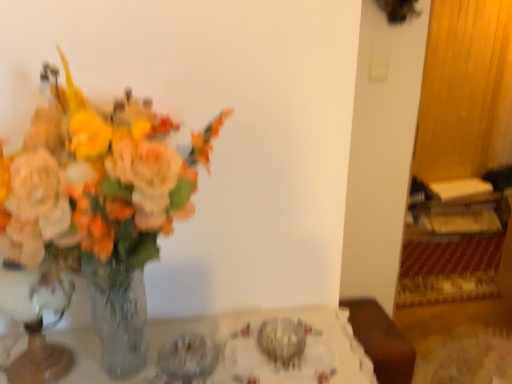
Question: Is translucent glass vase at left surrounding clear glass vase at left?

Choices:
 (A) no
 (B) yes

Answer: (B)

Question: Would you say translucent glass vase at left is a long distance from clear glass vase at left?

Choices:
 (A) no
 (B) yes

Answer: (A)

Question: Considering the relative sizes of translucent glass vase at left and clear glass vase at left in the image provided, is translucent glass vase at left thinner than clear glass vase at left?

Choices:
 (A) no
 (B) yes

Answer: (A)

Question: Can you confirm if translucent glass vase at left is positioned to the left of clear glass vase at left?

Choices:
 (A) no
 (B) yes

Answer: (A)

Question: Does translucent glass vase at left come in front of clear glass vase at left?

Choices:
 (A) no
 (B) yes

Answer: (B)

Question: Looking at their shapes, would you say clear glass vase at left is wider or thinner than clear glass vase at left?

Choices:
 (A) thin
 (B) wide

Answer: (B)

Question: In the image, is clear glass vase at left on the left side or the right side of clear glass vase at left?

Choices:
 (A) left
 (B) right

Answer: (B)

Question: From a real-world perspective, is clear glass vase at left positioned above or below clear glass vase at left?

Choices:
 (A) above
 (B) below

Answer: (B)

Question: Is clear glass vase at left in front of or behind clear glass vase at left in the image?

Choices:
 (A) front
 (B) behind

Answer: (B)

Question: From a real-world perspective, relative to clear glass vase at left, is translucent glass vase at left vertically above or below?

Choices:
 (A) below
 (B) above

Answer: (B)

Question: From the image's perspective, relative to clear glass vase at left, is translucent glass vase at left above or below?

Choices:
 (A) above
 (B) below

Answer: (A)

Question: Is translucent glass vase at left taller or shorter than clear glass vase at left?

Choices:
 (A) tall
 (B) short

Answer: (A)

Question: Is translucent glass vase at left to the left or to the right of clear glass vase at left in the image?

Choices:
 (A) right
 (B) left

Answer: (A)

Question: Is point (106, 231) closer or farther from the camera than point (330, 354)?

Choices:
 (A) farther
 (B) closer

Answer: (B)

Question: Based on their positions, is translucent glass vase at left located to the left or right of clear glass vase at left?

Choices:
 (A) right
 (B) left

Answer: (B)